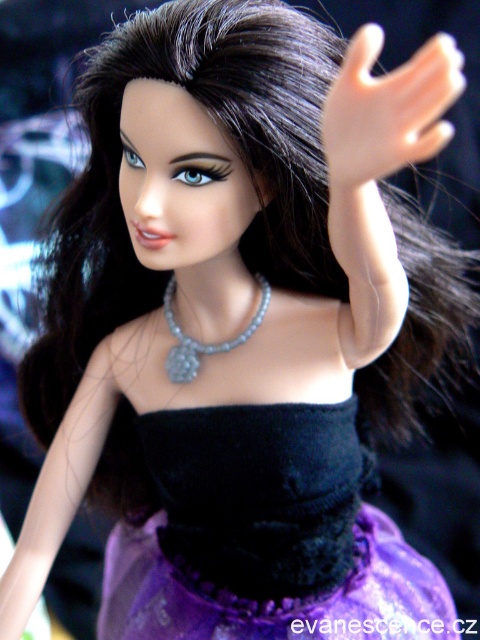
Can you confirm if translucent plastic hand at upper right is positioned above pearl-like beads necklace at center?

Correct, translucent plastic hand at upper right is located above pearl-like beads necklace at center.

Can you confirm if translucent plastic hand at upper right is smaller than pearl-like beads necklace at center?

Incorrect, translucent plastic hand at upper right is not smaller in size than pearl-like beads necklace at center.

Does point (362, 97) come behind point (169, 323)?

No, it is not.

At what (x,y) coordinates should I click in order to perform the action: click on translucent plastic hand at upper right. Please return your answer as a coordinate pair (x, y). This screenshot has width=480, height=640. Looking at the image, I should click on (386, 109).

Is purple velvet dress at center below translucent plastic hand at upper right?

Correct, purple velvet dress at center is located below translucent plastic hand at upper right.

Measure the distance between point (x=397, y=564) and camera.

A distance of 33.76 inches exists between point (x=397, y=564) and camera.

Identify the location of purple velvet dress at center. pyautogui.click(x=264, y=536).

Can you confirm if purple velvet dress at center is shorter than pearl-like beads necklace at center?

No, purple velvet dress at center is not shorter than pearl-like beads necklace at center.

Measure the distance between purple velvet dress at center and pearl-like beads necklace at center.

purple velvet dress at center is 20.39 centimeters from pearl-like beads necklace at center.

Which is in front, point (253, 410) or point (170, 356)?

Point (253, 410)

Find the location of `purple velvet dress at center`. purple velvet dress at center is located at coordinates (264, 536).